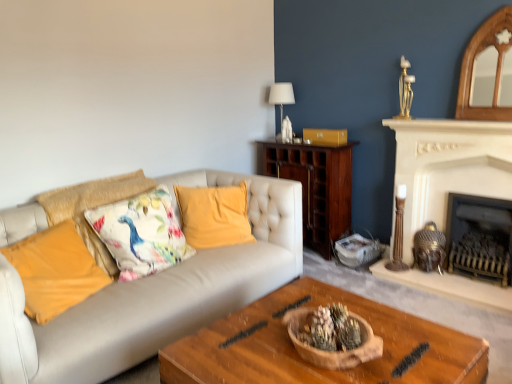
Question: Does black metal fireplace at right, acting as the first fireplace starting from the right, have a lesser width compared to floral fabric cushion at center left, the 2th pillow viewed from the right?

Choices:
 (A) no
 (B) yes

Answer: (B)

Question: Does black metal fireplace at right, acting as the first fireplace starting from the right, appear on the right side of floral fabric cushion at center left, the 2th pillow viewed from the right?

Choices:
 (A) no
 (B) yes

Answer: (B)

Question: Is the position of black metal fireplace at right, the second fireplace in the left-to-right sequence, more distant than that of floral fabric cushion at center left, the 3th pillow in the left-to-right sequence?

Choices:
 (A) no
 (B) yes

Answer: (B)

Question: Considering the relative sizes of black metal fireplace at right, acting as the first fireplace starting from the right, and floral fabric cushion at center left, the 2th pillow viewed from the right, in the image provided, is black metal fireplace at right, acting as the first fireplace starting from the right, wider than floral fabric cushion at center left, the 2th pillow viewed from the right,?

Choices:
 (A) no
 (B) yes

Answer: (A)

Question: Is black metal fireplace at right, the second fireplace in the left-to-right sequence, far away from floral fabric cushion at center left, the 3th pillow in the left-to-right sequence?

Choices:
 (A) yes
 (B) no

Answer: (A)

Question: Looking at the image, does floral fabric cushion at center left, the 3th pillow in the left-to-right sequence, seem bigger or smaller compared to yellow velvet pillow at center, which ranks as the first pillow in right-to-left order?

Choices:
 (A) big
 (B) small

Answer: (A)

Question: From the image's perspective, is floral fabric cushion at center left, the 3th pillow in the left-to-right sequence, positioned above or below yellow velvet pillow at center, which ranks as the 4th pillow in left-to-right order?

Choices:
 (A) above
 (B) below

Answer: (B)

Question: Is floral fabric cushion at center left, the 3th pillow in the left-to-right sequence, to the left or to the right of yellow velvet pillow at center, which ranks as the first pillow in right-to-left order, in the image?

Choices:
 (A) left
 (B) right

Answer: (A)

Question: Is point (161, 248) closer or farther from the camera than point (233, 230)?

Choices:
 (A) closer
 (B) farther

Answer: (A)

Question: Is yellow fabric pillow at left, the fourth pillow positioned from the right, taller or shorter than floral fabric cushion at left, the third pillow when ordered from right to left?

Choices:
 (A) short
 (B) tall

Answer: (A)

Question: Considering the relative positions of yellow fabric pillow at left, the fourth pillow positioned from the right, and floral fabric cushion at left, which is the second pillow in left-to-right order, in the image provided, is yellow fabric pillow at left, the fourth pillow positioned from the right, to the left or to the right of floral fabric cushion at left, which is the second pillow in left-to-right order,?

Choices:
 (A) left
 (B) right

Answer: (A)

Question: Is yellow fabric pillow at left, the fourth pillow positioned from the right, in front of or behind floral fabric cushion at left, which is the second pillow in left-to-right order, in the image?

Choices:
 (A) behind
 (B) front

Answer: (B)

Question: Is point (30, 243) positioned closer to the camera than point (115, 185)?

Choices:
 (A) closer
 (B) farther

Answer: (A)

Question: From the image's perspective, is yellow fabric pillow at left, the fourth pillow positioned from the right, located above or below floral fabric cushion at center left, the 2th pillow viewed from the right?

Choices:
 (A) above
 (B) below

Answer: (B)

Question: In the image, is yellow fabric pillow at left, the fourth pillow positioned from the right, positioned in front of or behind floral fabric cushion at center left, the 2th pillow viewed from the right?

Choices:
 (A) behind
 (B) front

Answer: (B)